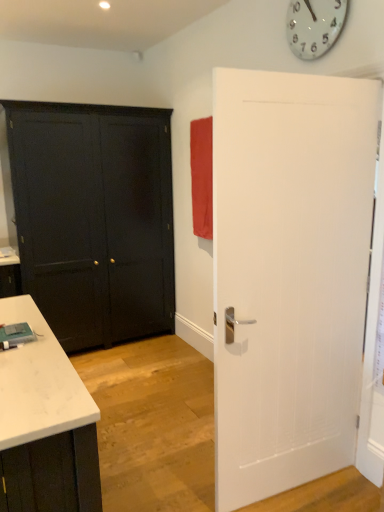
Describe the element at coordinates (314, 26) in the screenshot. This screenshot has height=512, width=384. I see `white glossy clock at upper center` at that location.

Locate an element on the screen. The width and height of the screenshot is (384, 512). matte red curtain at upper right is located at coordinates (202, 176).

This screenshot has width=384, height=512. Identify the location of white glossy clock at upper center. (314, 26).

Looking at their sizes, would you say white glossy clock at upper center is wider or thinner than matte black door at left, arranged as the second door when viewed from the front?

white glossy clock at upper center is thinner than matte black door at left, arranged as the second door when viewed from the front.

Which point is more distant from viewer, (334, 26) or (129, 154)?

The point (129, 154) is more distant.

Based on the photo, could you tell me if white glossy clock at upper center is turned towards matte black door at left, arranged as the second door when viewed from the front?

No, white glossy clock at upper center does not turn towards matte black door at left, arranged as the second door when viewed from the front.

Is white glossy clock at upper center smaller than matte black door at left, the 2th door from the right?

Correct, white glossy clock at upper center occupies less space than matte black door at left, the 2th door from the right.

What are the coordinates of `door behind the white glossy clock at upper center` in the screenshot? It's located at (94, 219).

Between matte black door at left, the first door positioned from the back, and white glossy clock at upper center, which one has less height?

white glossy clock at upper center is shorter.

Can you confirm if matte black door at left, arranged as the second door when viewed from the front, is bigger than white glossy clock at upper center?

Indeed, matte black door at left, arranged as the second door when viewed from the front, has a larger size compared to white glossy clock at upper center.

Is white glossy clock at upper center located within matte black door at left, the 2th door from the right?

Actually, white glossy clock at upper center is outside matte black door at left, the 2th door from the right.

From the picture: Is white glossy clock at upper center wider or thinner than matte red curtain at upper right?

In the image, white glossy clock at upper center appears to be more narrow than matte red curtain at upper right.

Which is closer to the camera, (333, 6) or (193, 220)?

Clearly, point (333, 6) is closer to the camera than point (193, 220).

From the image's perspective, is white glossy clock at upper center located beneath matte red curtain at upper right?

Actually, white glossy clock at upper center appears above matte red curtain at upper right in the image.

How many degrees apart are the facing directions of matte black door at left, acting as the first door starting from the left, and matte red curtain at upper right?

The angle between the facing direction of matte black door at left, acting as the first door starting from the left, and the facing direction of matte red curtain at upper right is 87.8 degrees.

Would you say matte black door at left, acting as the first door starting from the left, is to the left or to the right of matte red curtain at upper right in the picture?

Based on their positions, matte black door at left, acting as the first door starting from the left, is located to the left of matte red curtain at upper right.

Considering the sizes of objects matte black door at left, the 2th door from the right, and matte red curtain at upper right in the image provided, who is wider, matte black door at left, the 2th door from the right, or matte red curtain at upper right?

With larger width is matte black door at left, the 2th door from the right.

Find the location of a particular element. The width and height of the screenshot is (384, 512). curtain on the right of matte black door at left, arranged as the second door when viewed from the front is located at coordinates (202, 176).

Which of these two, matte red curtain at upper right or white textured door at right, which is counted as the 1th door, starting from the right, is bigger?

white textured door at right, which is counted as the 1th door, starting from the right.

Is white textured door at right, the second door positioned from the back, located within matte red curtain at upper right?

No.

Which of these two, matte red curtain at upper right or white textured door at right, the second door positioned from the back, stands shorter?

matte red curtain at upper right.

Is matte red curtain at upper right thinner than white textured door at right, positioned as the 2th door in left-to-right order?

Incorrect, the width of matte red curtain at upper right is not less than that of white textured door at right, positioned as the 2th door in left-to-right order.

Does matte black door at left, the 2th door from the right, have a larger size compared to white textured door at right, which is counted as the 1th door, starting from the right?

Yes, matte black door at left, the 2th door from the right, is bigger than white textured door at right, which is counted as the 1th door, starting from the right.

From a real-world perspective, which object stands above the other?

From a 3D spatial view, matte black door at left, acting as the first door starting from the left, is above.

From the image's perspective, is matte black door at left, the 2th door from the right, over white textured door at right, which is counted as the 1th door, starting from the right?

Yes, from the image's perspective, matte black door at left, the 2th door from the right, is on top of white textured door at right, which is counted as the 1th door, starting from the right.

Locate an element on the screen. door directly beneath the matte black door at left, the first door positioned from the back (from a real-world perspective) is located at coordinates (289, 275).

Is matte black door at left, acting as the first door starting from the left, a part of white textured door at right, the second door positioned from the back?

That's incorrect, matte black door at left, acting as the first door starting from the left, is not inside white textured door at right, the second door positioned from the back.

Which of these two, white textured door at right, which ranks as the 1th door in front-to-back order, or matte black door at left, arranged as the second door when viewed from the front, is wider?

matte black door at left, arranged as the second door when viewed from the front, is wider.

Which object is further away from the camera, white textured door at right, the second door positioned from the back, or matte black door at left, the first door positioned from the back?

matte black door at left, the first door positioned from the back, is behind.

From a real-world perspective, is white textured door at right, which is counted as the 1th door, starting from the right, under matte black door at left, the 2th door from the right?

Yes, from a real-world perspective, white textured door at right, which is counted as the 1th door, starting from the right, is beneath matte black door at left, the 2th door from the right.

You are a GUI agent. You are given a task and a screenshot of the screen. Output one action in this format:
    pyautogui.click(x=<x>, y=<y>)
    Task: Click on the door lying behind the white glossy clock at upper center
    The image size is (384, 512).
    Given the screenshot: What is the action you would take?
    pyautogui.click(x=94, y=219)

Find the location of a particular element. clock in front of the matte black door at left, the first door positioned from the back is located at coordinates (314, 26).

When comparing their distances from matte black door at left, the first door positioned from the back, does matte red curtain at upper right or white textured door at right, the second door positioned from the back, seem closer?

matte red curtain at upper right.

Estimate the real-world distances between objects in this image. Which object is further from matte red curtain at upper right, matte black door at left, the first door positioned from the back, or white textured door at right, the second door positioned from the back?

white textured door at right, the second door positioned from the back, lies further to matte red curtain at upper right than the other object.

When comparing their distances from white textured door at right, which ranks as the 1th door in front-to-back order, does matte black door at left, the first door positioned from the back, or white glossy clock at upper center seem closer?

Among the two, white glossy clock at upper center is located nearer to white textured door at right, which ranks as the 1th door in front-to-back order.

Consider the image. Looking at the image, which one is located further to matte red curtain at upper right, white glossy clock at upper center or matte black door at left, the 2th door from the right?

white glossy clock at upper center lies further to matte red curtain at upper right than the other object.

When comparing their distances from white textured door at right, the second door positioned from the back, does matte red curtain at upper right or white glossy clock at upper center seem further?

matte red curtain at upper right lies further to white textured door at right, the second door positioned from the back, than the other object.

Which object lies further to the anchor point matte red curtain at upper right, matte black door at left, arranged as the second door when viewed from the front, or white glossy clock at upper center?

white glossy clock at upper center lies further to matte red curtain at upper right than the other object.

Based on their spatial positions, is matte red curtain at upper right or white textured door at right, positioned as the 2th door in left-to-right order, further from white glossy clock at upper center?

The object further to white glossy clock at upper center is matte red curtain at upper right.

Estimate the real-world distances between objects in this image. Which object is closer to matte red curtain at upper right, white textured door at right, which ranks as the 1th door in front-to-back order, or white glossy clock at upper center?

white glossy clock at upper center lies closer to matte red curtain at upper right than the other object.

Find the location of a particular element. The width and height of the screenshot is (384, 512). curtain between matte black door at left, acting as the first door starting from the left, and white glossy clock at upper center from left to right is located at coordinates (202, 176).

You are a GUI agent. You are given a task and a screenshot of the screen. Output one action in this format:
    pyautogui.click(x=<x>, y=<y>)
    Task: Click on the door between white textured door at right, which ranks as the 1th door in front-to-back order, and matte red curtain at upper right from front to back
    This screenshot has width=384, height=512.
    Given the screenshot: What is the action you would take?
    pyautogui.click(x=94, y=219)

Image resolution: width=384 pixels, height=512 pixels. Identify the location of clock between white textured door at right, which ranks as the 1th door in front-to-back order, and matte red curtain at upper right in the front-back direction. (314, 26).

Locate an element on the screen. This screenshot has height=512, width=384. door between matte black door at left, arranged as the second door when viewed from the front, and white glossy clock at upper center from left to right is located at coordinates (289, 275).